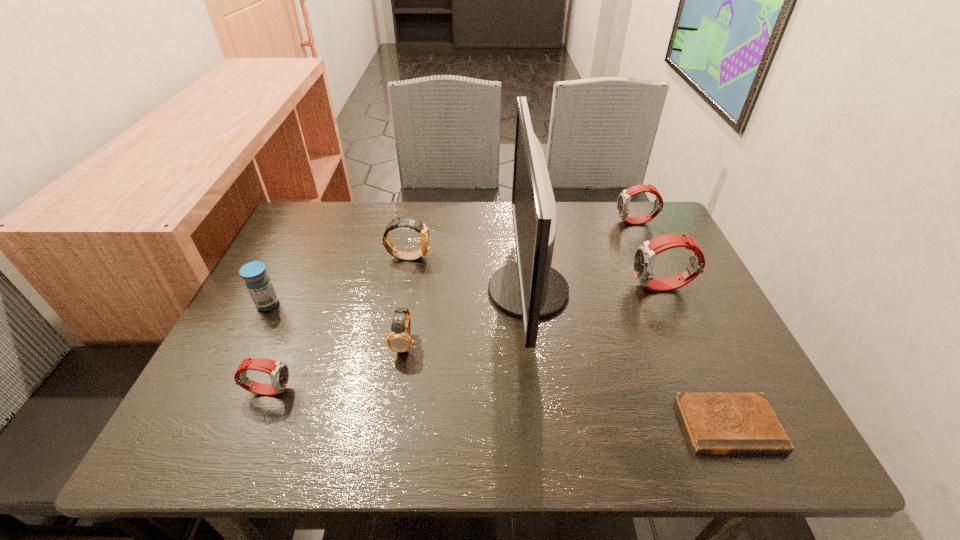
Find the location of a particular element. vacant space located on the face of the second farthest red watch is located at coordinates (506, 287).

The image size is (960, 540). Identify the location of vacant space situated on the face of the second farthest red watch. (565, 287).

At what (x,y) coordinates should I click in order to perform the action: click on vacant region located on the face of the bigger gold watch. Please return your answer as a coordinate pair (x, y). The width and height of the screenshot is (960, 540). Looking at the image, I should click on (551, 256).

The height and width of the screenshot is (540, 960). I want to click on free region located on the face of the farthest red watch, so click(x=583, y=222).

The image size is (960, 540). Find the location of `vacant space located 0.230m on the face of the farthest red watch`. vacant space located 0.230m on the face of the farthest red watch is located at coordinates (540, 222).

Locate an element on the screen. Image resolution: width=960 pixels, height=540 pixels. vacant space situated 0.180m on the face of the farthest red watch is located at coordinates (556, 222).

The height and width of the screenshot is (540, 960). Find the location of `vacant space situated 0.150m on the front of the blue medicine`. vacant space situated 0.150m on the front of the blue medicine is located at coordinates (238, 364).

Where is `vacant space located on the face of the second nearest watch`? The width and height of the screenshot is (960, 540). vacant space located on the face of the second nearest watch is located at coordinates (397, 390).

Image resolution: width=960 pixels, height=540 pixels. Identify the location of free region located 0.320m on the face of the smallest red watch. (449, 389).

Find the location of `monitor at the far edge`. monitor at the far edge is located at coordinates (530, 288).